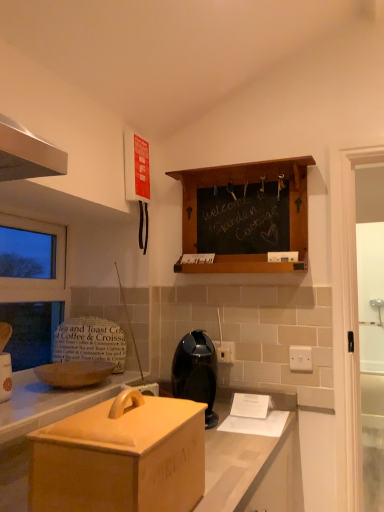
Question: Can you confirm if black plastic coffee maker at center is positioned to the left of matte wooden bread bin at lower left?

Choices:
 (A) no
 (B) yes

Answer: (A)

Question: From a real-world perspective, does black plastic coffee maker at center sit lower than matte wooden bread bin at lower left?

Choices:
 (A) no
 (B) yes

Answer: (A)

Question: Does black plastic coffee maker at center have a smaller size compared to matte wooden bread bin at lower left?

Choices:
 (A) no
 (B) yes

Answer: (B)

Question: Is black plastic coffee maker at center placed right next to matte wooden bread bin at lower left?

Choices:
 (A) no
 (B) yes

Answer: (A)

Question: Is black plastic coffee maker at center taller than matte wooden bread bin at lower left?

Choices:
 (A) yes
 (B) no

Answer: (A)

Question: From the image's perspective, is wooden chalkboard at center positioned above or below transparent glass door at right?

Choices:
 (A) below
 (B) above

Answer: (B)

Question: Is point (203, 268) positioned closer to the camera than point (372, 162)?

Choices:
 (A) farther
 (B) closer

Answer: (A)

Question: Considering their positions, is wooden chalkboard at center located in front of or behind transparent glass door at right?

Choices:
 (A) behind
 (B) front

Answer: (B)

Question: Based on their sizes in the image, would you say wooden chalkboard at center is bigger or smaller than transparent glass door at right?

Choices:
 (A) big
 (B) small

Answer: (B)

Question: From the image's perspective, relative to matte wooden bread bin at lower left, is transparent glass door at right above or below?

Choices:
 (A) below
 (B) above

Answer: (A)

Question: Is transparent glass door at right wider or thinner than matte wooden bread bin at lower left?

Choices:
 (A) wide
 (B) thin

Answer: (B)

Question: Which is correct: transparent glass door at right is inside matte wooden bread bin at lower left, or outside of it?

Choices:
 (A) outside
 (B) inside

Answer: (A)

Question: Considering the positions of transparent glass door at right and matte wooden bread bin at lower left in the image, is transparent glass door at right bigger or smaller than matte wooden bread bin at lower left?

Choices:
 (A) big
 (B) small

Answer: (A)

Question: Would you say transparent glass window at left is to the left or to the right of matte wooden bread bin at lower left in the picture?

Choices:
 (A) left
 (B) right

Answer: (A)

Question: From the image's perspective, is transparent glass window at left located above or below matte wooden bread bin at lower left?

Choices:
 (A) below
 (B) above

Answer: (B)